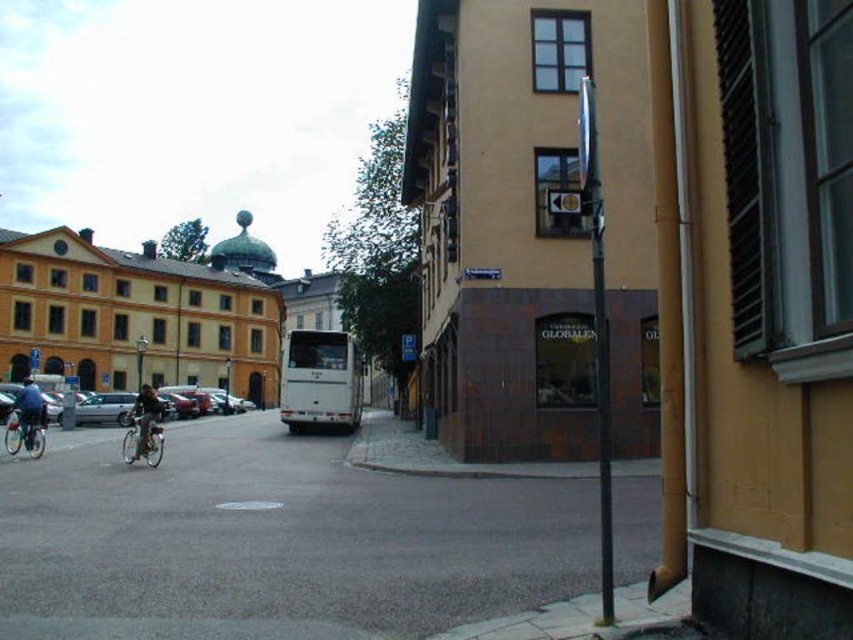
Question: Is dark brown leather jacket at left in front of silver metallic bicycle at lower left?

Choices:
 (A) yes
 (B) no

Answer: (A)

Question: Which of the following is the closest to the observer?

Choices:
 (A) (35, 452)
 (B) (148, 392)

Answer: (B)

Question: Which point is closer to the camera?

Choices:
 (A) (158, 428)
 (B) (33, 436)
 (C) (142, 397)

Answer: (A)

Question: Considering the relative positions of silver metallic bicycle at left and blue fabric jacket on the left in the image provided, where is silver metallic bicycle at left located with respect to blue fabric jacket on the left?

Choices:
 (A) right
 (B) left

Answer: (A)

Question: Can you confirm if silver metallic bicycle at lower left is wider than blue fabric jacket on the left?

Choices:
 (A) yes
 (B) no

Answer: (B)

Question: Which point is farther to the camera?

Choices:
 (A) (39, 424)
 (B) (27, 387)
 (C) (158, 464)
 (D) (158, 401)

Answer: (B)